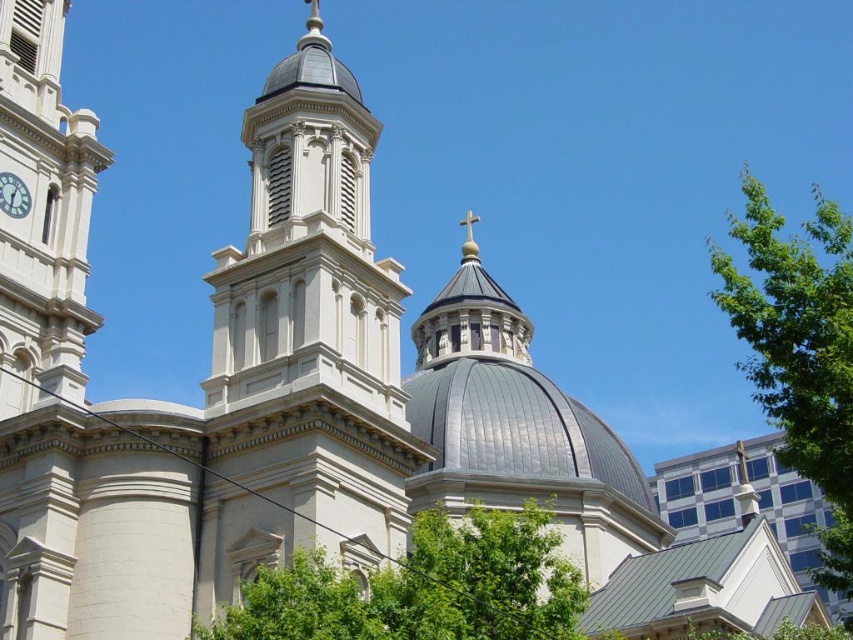
Does point (45, 141) come in front of point (747, 260)?

Yes, it is.

Does point (24, 77) come farther from viewer compared to point (822, 268)?

No, (24, 77) is closer to viewer.

Where is `white stone clock tower at left`? The height and width of the screenshot is (640, 853). white stone clock tower at left is located at coordinates (44, 202).

You are a GUI agent. You are given a task and a screenshot of the screen. Output one action in this format:
    pyautogui.click(x=<x>, y=<y>)
    Task: Click on the smooth white tower at center
    The image size is (853, 640).
    Given the screenshot: What is the action you would take?
    pyautogui.click(x=303, y=346)

Is point (378, 538) positioned after point (82, 342)?

That is False.

From the picture: Who is more distant from viewer, (314,120) or (68,355)?

The point (314,120) is more distant.

Where is `smooth white tower at center`? This screenshot has width=853, height=640. smooth white tower at center is located at coordinates (303, 346).

Is green leafy tree at center above white stone clock tower at left?

Actually, green leafy tree at center is below white stone clock tower at left.

Is green leafy tree at center shorter than white stone clock tower at left?

Indeed, green leafy tree at center has a lesser height compared to white stone clock tower at left.

Measure the distance between green leafy tree at center and camera.

green leafy tree at center and camera are 108.55 feet apart from each other.

Locate an element on the screen. The height and width of the screenshot is (640, 853). green leafy tree at center is located at coordinates (422, 588).